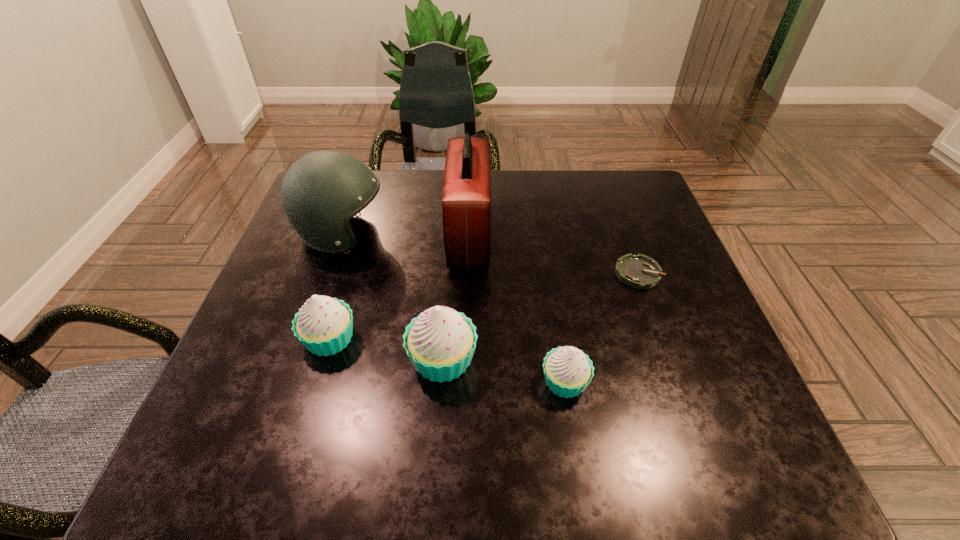
Given the evenly spaced cupcakes in the image, where should an extra cupcake be added on the right to preserve the spacing? Please point to a vacant space. Please provide its 2D coordinates. Your answer should be formatted as a tuple, i.e. [(x, y)], where the tuple contains the x and y coordinates of a point satisfying the conditions above.

[(698, 406)]